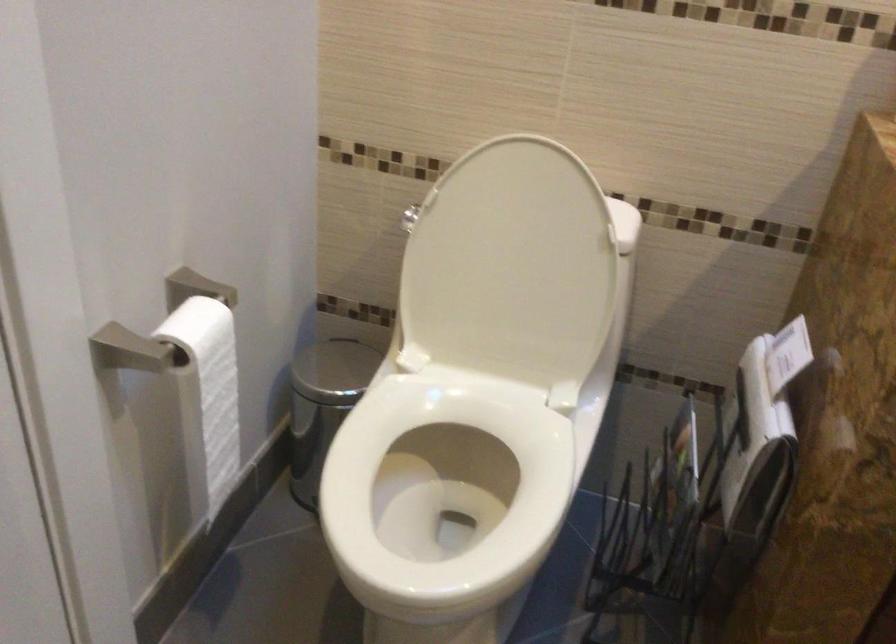
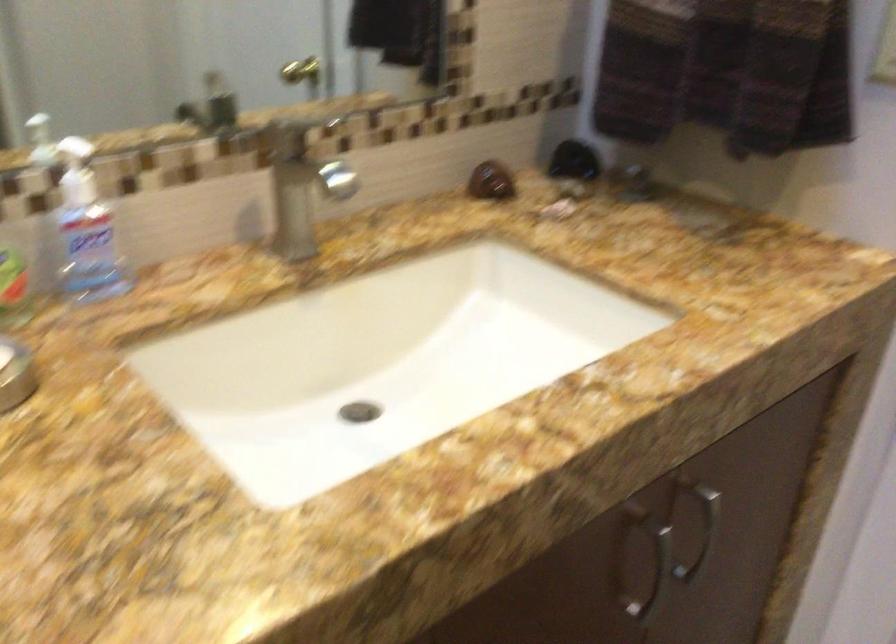
Question: The images are taken continuously from a first-person perspective. In which direction is your viewpoint rotating?

Choices:
 (A) Left
 (B) Right
 (C) Up
 (D) Down

Answer: (B)